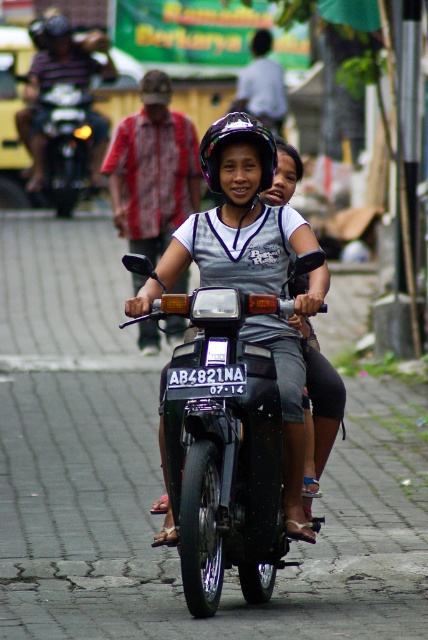
You are a drone operator trying to capture a photo of two matte black helmets. The two helmets are the matte black helmet at upper center and the matte black helmet at center. The camera has a maximum focus range of 15 feet. Will the drone be able to capture both helmets in focus at the same time?

The distance between the matte black helmet at upper center and the matte black helmet at center is 15.36 feet, which exceeds the camera maximum focus range of 15 feet. Therefore, the drone will not be able to capture both helmets in focus at the same time.